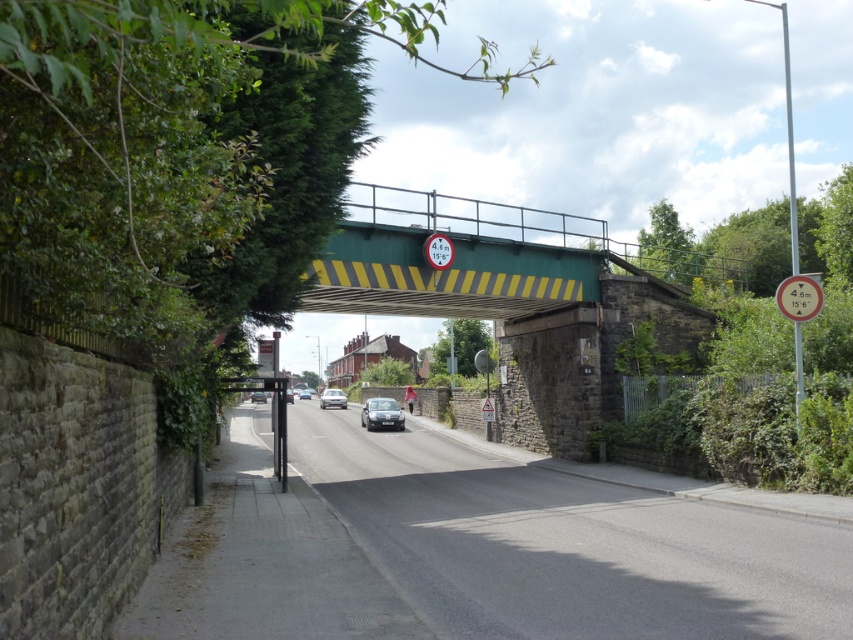
Question: Is the position of metallic circular sign at center less distant than that of metallic silver car at center?

Choices:
 (A) no
 (B) yes

Answer: (B)

Question: Which of the following is the farthest from the observer?

Choices:
 (A) [x=338, y=397]
 (B) [x=303, y=390]
 (C) [x=286, y=397]
 (D) [x=793, y=312]

Answer: (B)

Question: Is silver metallic car at center bigger than matte black car at center?

Choices:
 (A) yes
 (B) no

Answer: (B)

Question: Based on their relative distances, which object is farther from the metallic silver car at center?

Choices:
 (A) silver metallic car at center
 (B) metallic circular sign at center
 (C) green painted steel bridge at center

Answer: (B)

Question: Is shiny metallic car at center above metallic silver car at center?

Choices:
 (A) yes
 (B) no

Answer: (B)

Question: Among these points, which one is farthest from the camera?

Choices:
 (A) (309, 394)
 (B) (361, 260)

Answer: (A)